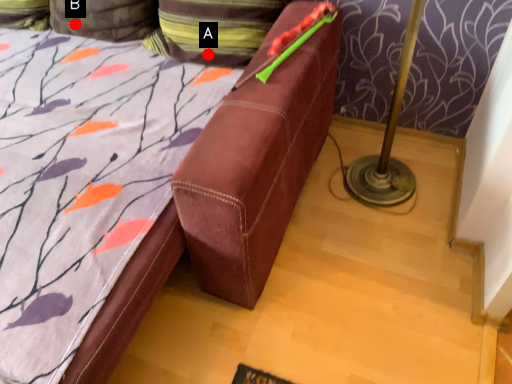
Question: Two points are circled on the image, labeled by A and B beside each circle. Among these points, which one is nearest to the camera?

Choices:
 (A) A is closer
 (B) B is closer

Answer: (A)